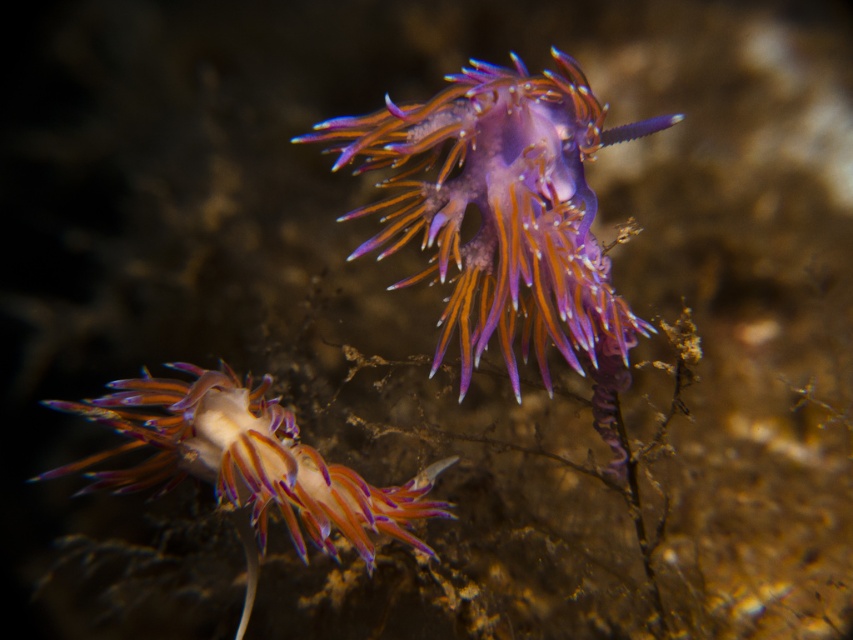
Between purple translucent nudibranch at center and translucent purple nudibranch at center, which one appears on the right side from the viewer's perspective?

purple translucent nudibranch at center

Looking at this image, can you confirm if purple translucent nudibranch at center is positioned above translucent purple nudibranch at center?

Yes.

Is point (488, 124) less distant than point (257, 387)?

Yes, point (488, 124) is in front of point (257, 387).

Identify the location of purple translucent nudibranch at center. (502, 208).